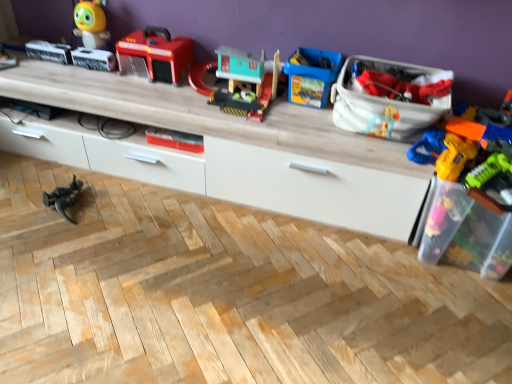
Question: Is matte plastic fire truck at upper center, which is the 5th toy from right to left, bigger than black plastic dinosaur at lower left, which is the first toy from left to right?

Choices:
 (A) yes
 (B) no

Answer: (A)

Question: Could you tell me if matte plastic fire truck at upper center, the third toy when ordered from left to right, is turned towards black plastic dinosaur at lower left, the 7th toy from the right?

Choices:
 (A) no
 (B) yes

Answer: (A)

Question: Is matte plastic fire truck at upper center, the third toy when ordered from left to right, surrounding black plastic dinosaur at lower left, which is the first toy from left to right?

Choices:
 (A) yes
 (B) no

Answer: (B)

Question: From the image's perspective, is matte plastic fire truck at upper center, which is the 5th toy from right to left, on black plastic dinosaur at lower left, the 7th toy from the right?

Choices:
 (A) no
 (B) yes

Answer: (B)

Question: Is matte plastic fire truck at upper center, the third toy when ordered from left to right, shorter than black plastic dinosaur at lower left, which is the first toy from left to right?

Choices:
 (A) no
 (B) yes

Answer: (A)

Question: Based on their sizes in the image, would you say matte plastic toy at center, which is counted as the fourth toy, starting from the left, is bigger or smaller than matte plastic fire truck at upper center, the third toy when ordered from left to right?

Choices:
 (A) big
 (B) small

Answer: (B)

Question: Considering the positions of point (177, 145) and point (138, 69), is point (177, 145) closer or farther from the camera than point (138, 69)?

Choices:
 (A) farther
 (B) closer

Answer: (B)

Question: From the image's perspective, relative to matte plastic fire truck at upper center, which is the 5th toy from right to left, is matte plastic toy at center, which is the 4th toy from right to left, above or below?

Choices:
 (A) below
 (B) above

Answer: (A)

Question: In terms of width, does matte plastic toy at center, which is counted as the fourth toy, starting from the left, look wider or thinner when compared to matte plastic fire truck at upper center, the third toy when ordered from left to right?

Choices:
 (A) thin
 (B) wide

Answer: (A)

Question: From a real-world perspective, is wooden entertainment center at upper center positioned above or below shiny plastic toy at upper left, the second toy in the left-to-right sequence?

Choices:
 (A) below
 (B) above

Answer: (A)

Question: Is point (331, 150) closer or farther from the camera than point (104, 21)?

Choices:
 (A) closer
 (B) farther

Answer: (A)

Question: In terms of width, does wooden entertainment center at upper center look wider or thinner when compared to shiny plastic toy at upper left, the second toy in the left-to-right sequence?

Choices:
 (A) thin
 (B) wide

Answer: (B)

Question: Looking at the image, does wooden entertainment center at upper center seem bigger or smaller compared to shiny plastic toy at upper left, which is the 6th toy in right-to-left order?

Choices:
 (A) small
 (B) big

Answer: (B)

Question: Is matte plastic toy at center, which is the 4th toy from right to left, inside the boundaries of white fabric bag at upper right, which appears as the second storage box when viewed from the right, or outside?

Choices:
 (A) inside
 (B) outside

Answer: (B)

Question: From a real-world perspective, relative to white fabric bag at upper right, which is counted as the first storage box, starting from the left, is matte plastic toy at center, which is counted as the fourth toy, starting from the left, vertically above or below?

Choices:
 (A) above
 (B) below

Answer: (B)